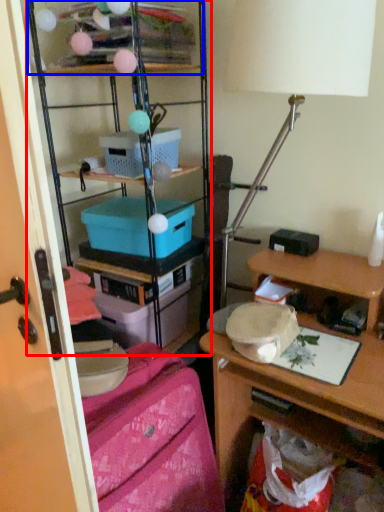
Question: Which object is further to the camera taking this photo, shelf (highlighted by a red box) or shelf (highlighted by a blue box)?

Choices:
 (A) shelf
 (B) shelf

Answer: (B)